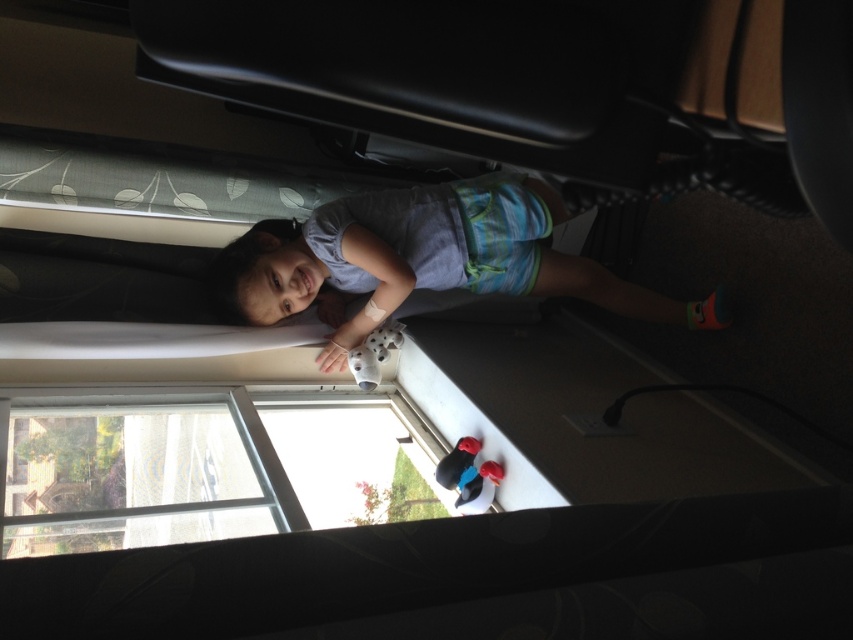
You are a fashion designer observing the scene. You need to determine which item has a greater width between the light blue cotton shirt at upper center and the clear glass window at lower left without measuring tools. Based on the scene, which object is wider?

The light blue cotton shirt at upper center is wider than the clear glass window at lower left according to the description.

You are a delivery robot with a height of 1.6 meters. You need to deliver a package to the light blue cotton shirt at upper center. Can you reach it without climbing?

The light blue cotton shirt at upper center is 1.68 meters away from the viewer. Since the robot is 1.6 meters tall, it cannot reach the shirt as the distance is greater than its height.

You are a parent looking for your child who is lying on a bed or couch. You remember your child has a light blue cotton shirt at upper center. Where should you look based on the coordinates provided?

The light blue cotton shirt at upper center is located at point (422, 260), so you should look there.